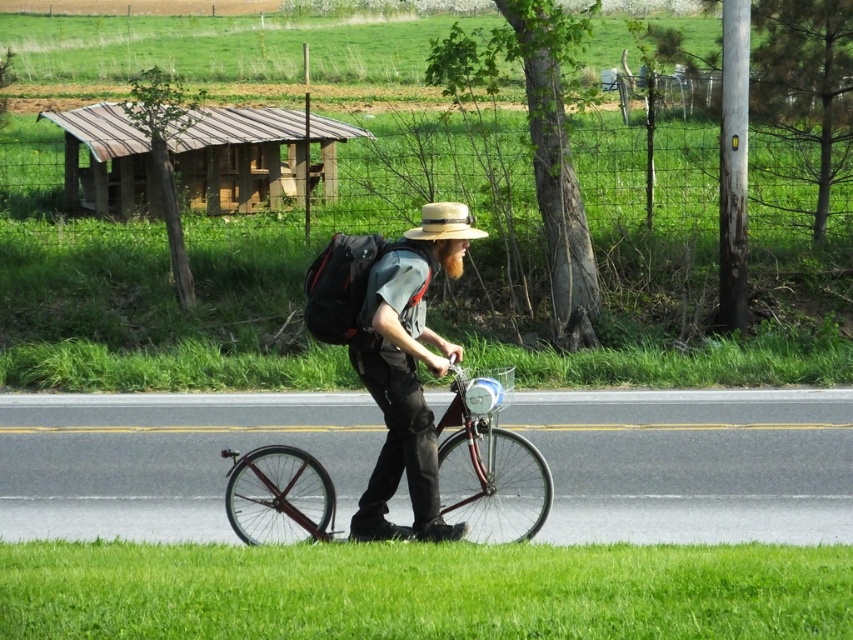
Question: Which object appears closest to the camera in this image?

Choices:
 (A) rusty wood hut at upper left
 (B) woven straw hat at center

Answer: (B)

Question: Considering the relative positions of matte brown hat at center and woven straw hat at center in the image provided, where is matte brown hat at center located with respect to woven straw hat at center?

Choices:
 (A) left
 (B) right

Answer: (A)

Question: Is rusty wood hut at upper left wider than matte brown hat at center?

Choices:
 (A) yes
 (B) no

Answer: (A)

Question: Which point is closer to the camera taking this photo?

Choices:
 (A) (271, 490)
 (B) (282, 182)
 (C) (415, 323)

Answer: (C)

Question: Is matte brown hat at center closer to camera compared to shiny red bicycle at center?

Choices:
 (A) yes
 (B) no

Answer: (A)

Question: Which is nearer to the matte brown hat at center?

Choices:
 (A) rusty wood hut at upper left
 (B) woven straw hat at center
 (C) shiny red bicycle at center

Answer: (B)